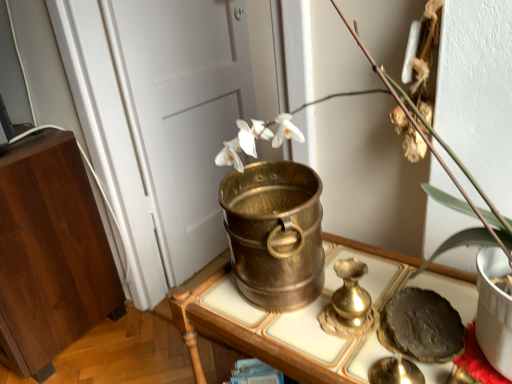
Question: From the image's perspective, relative to white matte door at center, is brass bucket at center, the first furniture when ordered from front to back, above or below?

Choices:
 (A) above
 (B) below

Answer: (B)

Question: In terms of width, does brass bucket at center, the first furniture when ordered from front to back, look wider or thinner when compared to white matte door at center?

Choices:
 (A) thin
 (B) wide

Answer: (B)

Question: Considering the real-world distances, which object is closest to the brass bucket at center, which is the 1th furniture from right to left?

Choices:
 (A) white matte door at center
 (B) shiny dark plate at lower right
 (C) wooden cabinet at left, the second furniture from the front
 (D) white porcelain vase at center

Answer: (B)

Question: Which of these objects is positioned closest to the shiny dark plate at lower right?

Choices:
 (A) brass bucket at center, which is the 1th furniture from right to left
 (B) white porcelain vase at center
 (C) white matte door at center
 (D) wooden cabinet at left, positioned as the second furniture in right-to-left order

Answer: (A)